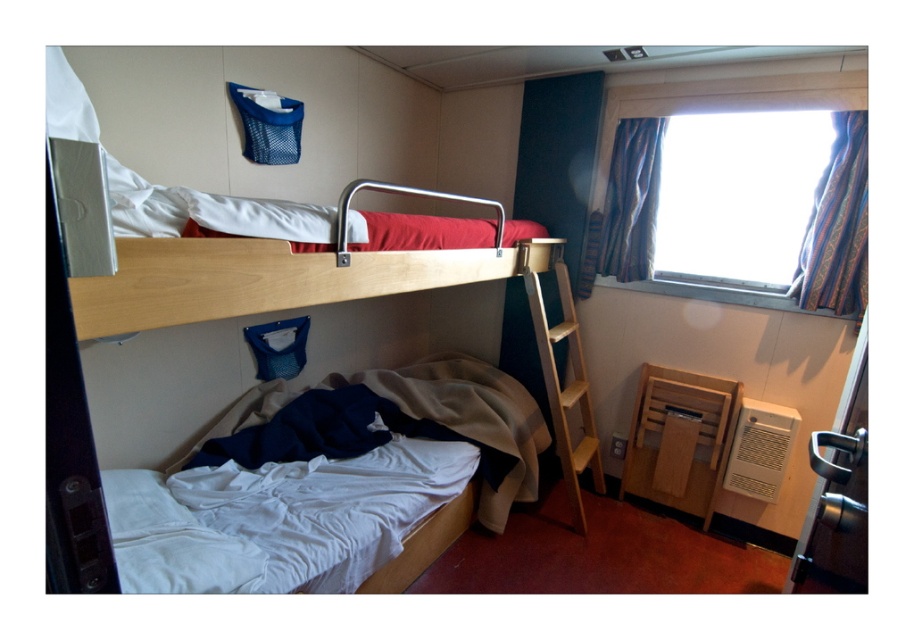
You are a traveler who wants to move a small suitcase from the wooden bunk bed at center to the striped fabric curtain at window. Can you place the suitcase between them without it touching either object? The suitcase is 20 inches long.

The wooden bunk bed at center and striped fabric curtain at window are 34.26 inches apart. Since the suitcase is 20 inches long, there is enough space between them to place it without touching either object.

You are staying in this cabin and need to place a small nightstand between the wooden at right and the striped fabric curtain at window. Based on their positions, which object should the nightstand be closer to?

The wooden at right is to the left of striped fabric curtain at window, so the nightstand should be placed closer to the striped fabric curtain at window to maintain the leftward position of the wooden at right.

You are standing in the room and want to reach both points. Which point is closer to you, point [776,208] or point [793,285]?

Point [776,208] is closer to you because it is further to the viewer than point [793,285].